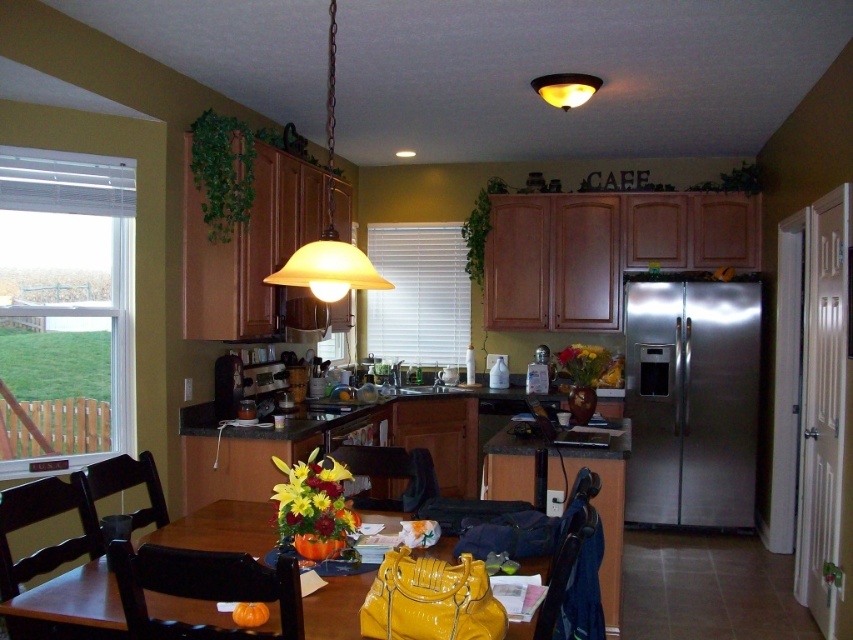
Who is more forward, (x=343, y=580) or (x=30, y=502)?

Point (x=343, y=580) is in front.

Which is below, wooden table at center or dark wood chair at lower left?

A: wooden table at center is below.

Is point (225, 506) less distant than point (4, 520)?

That is False.

Where is `wooden table at center`? wooden table at center is located at coordinates (68, 605).

Is stainless steel refrigerator at right thinner than matte yellow glass pendant light at upper center?

In fact, stainless steel refrigerator at right might be wider than matte yellow glass pendant light at upper center.

Between stainless steel refrigerator at right and matte yellow glass pendant light at upper center, which one has more height?

With more height is stainless steel refrigerator at right.

Describe the element at coordinates (691, 401) in the screenshot. I see `stainless steel refrigerator at right` at that location.

Identify the location of stainless steel refrigerator at right. (691, 401).

Is the position of stainless steel refrigerator at right less distant than that of wooden table at center?

No, stainless steel refrigerator at right is further to the viewer.

Who is more forward, (x=625, y=328) or (x=323, y=632)?

Point (x=323, y=632) is more forward.

Where is `stainless steel refrigerator at right`? This screenshot has width=853, height=640. stainless steel refrigerator at right is located at coordinates (691, 401).

Where is `stainless steel refrigerator at right`? The image size is (853, 640). stainless steel refrigerator at right is located at coordinates (691, 401).